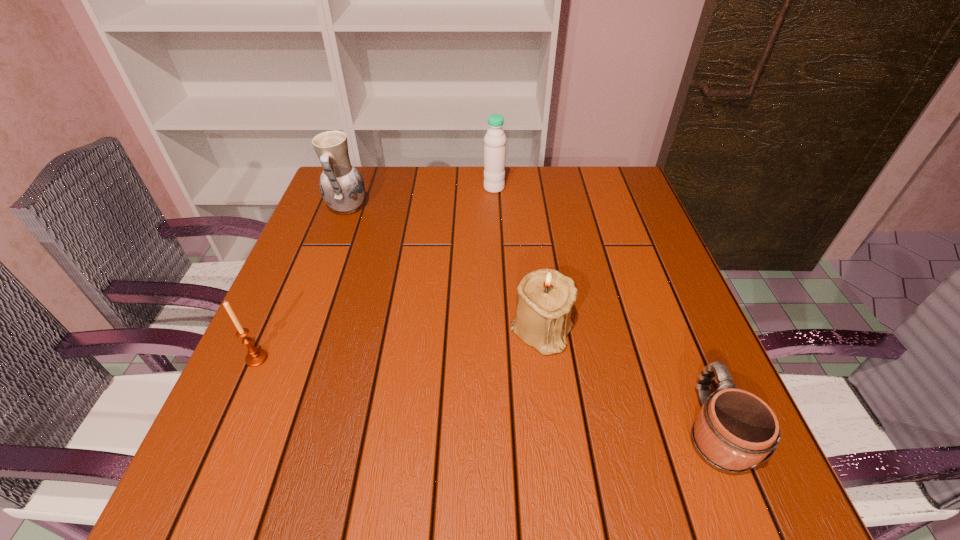
You are a GUI agent. You are given a task and a screenshot of the screen. Output one action in this format:
    pyautogui.click(x=<x>, y=<y>)
    Task: Click on the water bottle
    This screenshot has height=540, width=960.
    Given the screenshot: What is the action you would take?
    pyautogui.click(x=495, y=139)

Locate an element on the screen. pottery is located at coordinates (341, 185).

Locate an element on the screen. the right candle_holder is located at coordinates (545, 297).

Where is `the left candle_holder`? Image resolution: width=960 pixels, height=540 pixels. the left candle_holder is located at coordinates (255, 357).

The image size is (960, 540). Find the location of `the shortest object`. the shortest object is located at coordinates (734, 430).

Identify the location of the nearest object. (734, 430).

You are a GUI agent. You are given a task and a screenshot of the screen. Output one action in this format:
    pyautogui.click(x=<x>, y=<y>)
    Task: Click on the blank space located on the left of the water bottle
    This screenshot has height=540, width=960.
    Given the screenshot: What is the action you would take?
    pyautogui.click(x=467, y=188)

The width and height of the screenshot is (960, 540). Find the location of `vacant area located on either side of the pottery`. vacant area located on either side of the pottery is located at coordinates (x=431, y=208).

At what (x,y) coordinates should I click in order to perform the action: click on free space located 0.240m on the back of the right candle_holder. Please return your answer as a coordinate pair (x, y). Image resolution: width=960 pixels, height=540 pixels. Looking at the image, I should click on (530, 235).

This screenshot has width=960, height=540. What are the coordinates of `blank space located 0.350m on the back of the left candle_holder` in the screenshot? It's located at tap(310, 237).